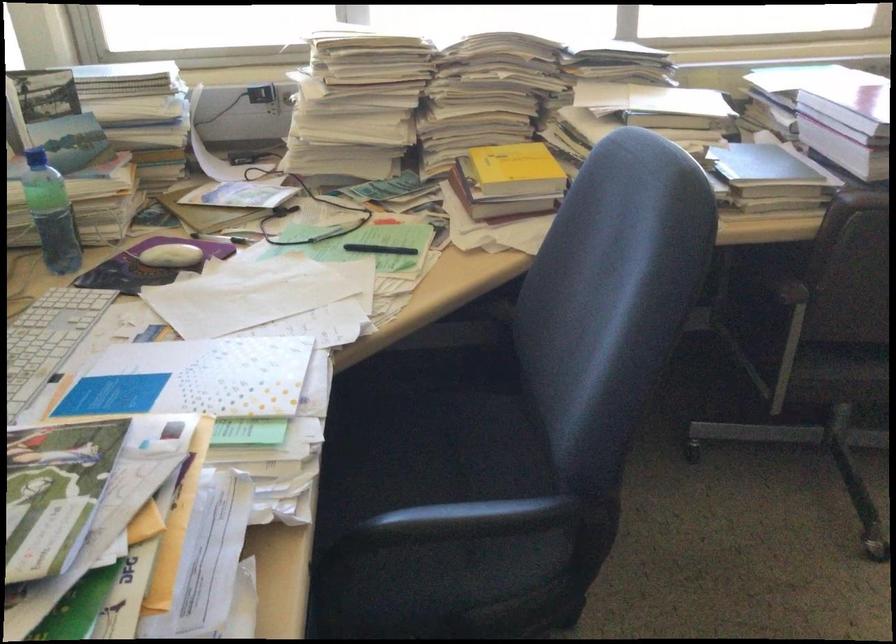
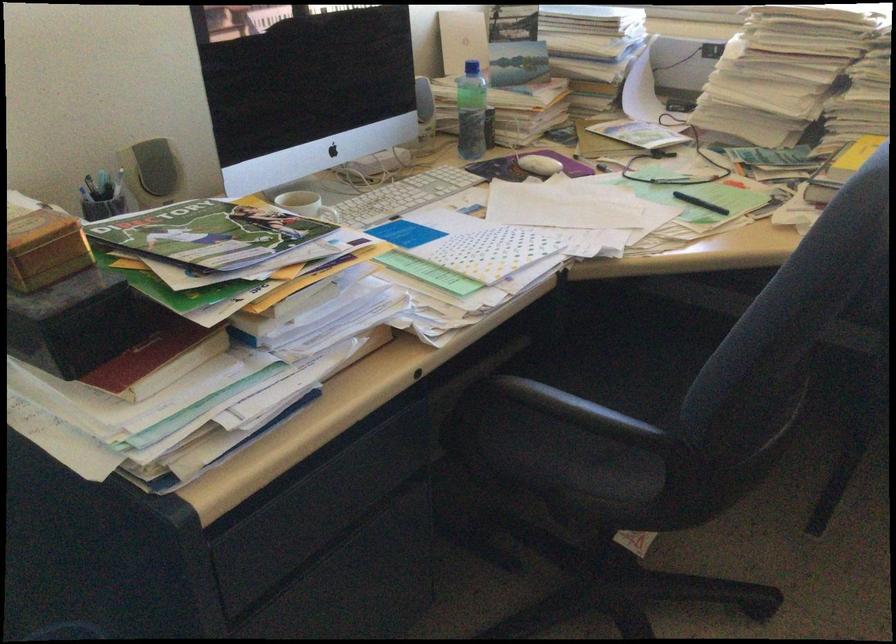
Find the pixel in the second image that matches point 178,259 in the first image.

(538, 165)